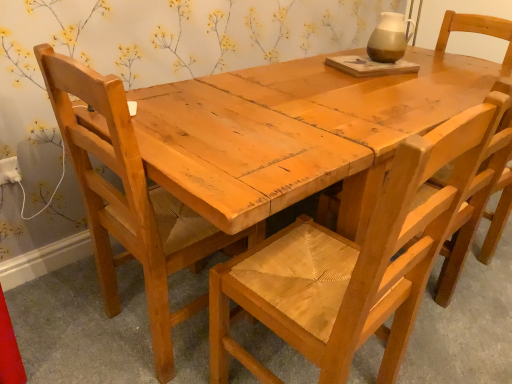
What is the approximate height of natural wood chair at left, marked as the 1th chair in a left-to-right arrangement?

37.28 inches.

Find the location of a particular element. This screenshot has width=512, height=384. wooden woven seat at center, which is counted as the 3th chair, starting from the left is located at coordinates (476, 198).

Find the location of `natural wood chair at center, which is counted as the 2th chair, starting from the left`. natural wood chair at center, which is counted as the 2th chair, starting from the left is located at coordinates (355, 261).

Who is shorter, wooden woven seat at center, which is counted as the 3th chair, starting from the left, or white plastic electric outlet at lower left?

Standing shorter between the two is white plastic electric outlet at lower left.

Can you tell me how much wooden woven seat at center, which is counted as the 3th chair, starting from the left, and white plastic electric outlet at lower left differ in facing direction?

They differ by 179 degrees in their facing directions.

Considering the relative sizes of wooden woven seat at center, which is counted as the 3th chair, starting from the left, and white plastic electric outlet at lower left in the image provided, is wooden woven seat at center, which is counted as the 3th chair, starting from the left, thinner than white plastic electric outlet at lower left?

No.

Which object is more forward, wooden woven seat at center, marked as the 1th chair in a right-to-left arrangement, or white plastic electric outlet at lower left?

wooden woven seat at center, marked as the 1th chair in a right-to-left arrangement, is more forward.

Could you tell me if natural wood chair at center, placed as the second chair when sorted from right to left, is facing wooden woven seat at center, marked as the 1th chair in a right-to-left arrangement?

No.

Is natural wood chair at center, placed as the second chair when sorted from right to left, not close to wooden woven seat at center, which is counted as the 3th chair, starting from the left?

Actually, natural wood chair at center, placed as the second chair when sorted from right to left, and wooden woven seat at center, which is counted as the 3th chair, starting from the left, are a little close together.

From the image's perspective, which object appears higher, natural wood chair at center, which is counted as the 2th chair, starting from the left, or wooden woven seat at center, marked as the 1th chair in a right-to-left arrangement?

wooden woven seat at center, marked as the 1th chair in a right-to-left arrangement.

Is natural wood chair at center, which is counted as the 2th chair, starting from the left, to the left of wooden woven seat at center, marked as the 1th chair in a right-to-left arrangement, from the viewer's perspective?

Indeed, natural wood chair at center, which is counted as the 2th chair, starting from the left, is positioned on the left side of wooden woven seat at center, marked as the 1th chair in a right-to-left arrangement.

Considering the sizes of natural wood chair at center, which is counted as the 2th chair, starting from the left, and natural wood chair at left, marked as the third chair in a right-to-left arrangement, in the image, is natural wood chair at center, which is counted as the 2th chair, starting from the left, wider or thinner than natural wood chair at left, marked as the third chair in a right-to-left arrangement,?

natural wood chair at center, which is counted as the 2th chair, starting from the left, is thinner than natural wood chair at left, marked as the third chair in a right-to-left arrangement.

From the image's perspective, between natural wood chair at center, which is counted as the 2th chair, starting from the left, and natural wood chair at left, marked as the 1th chair in a left-to-right arrangement, which one is located above?

natural wood chair at left, marked as the 1th chair in a left-to-right arrangement.

Is natural wood chair at center, which is counted as the 2th chair, starting from the left, not within natural wood chair at left, marked as the third chair in a right-to-left arrangement?

Yes.

In terms of size, does natural wood chair at center, placed as the second chair when sorted from right to left, appear bigger or smaller than natural wood chair at left, marked as the 1th chair in a left-to-right arrangement?

Clearly, natural wood chair at center, placed as the second chair when sorted from right to left, is smaller in size than natural wood chair at left, marked as the 1th chair in a left-to-right arrangement.

From the picture: Can you tell me how much white plastic electric outlet at lower left and wooden woven seat at center, which is counted as the 3th chair, starting from the left, differ in facing direction?

The facing directions of white plastic electric outlet at lower left and wooden woven seat at center, which is counted as the 3th chair, starting from the left, are 179 degrees apart.

Considering the relative sizes of white plastic electric outlet at lower left and wooden woven seat at center, marked as the 1th chair in a right-to-left arrangement, in the image provided, is white plastic electric outlet at lower left wider than wooden woven seat at center, marked as the 1th chair in a right-to-left arrangement,?

Incorrect, the width of white plastic electric outlet at lower left does not surpass that of wooden woven seat at center, marked as the 1th chair in a right-to-left arrangement.

Does white plastic electric outlet at lower left come in front of wooden woven seat at center, marked as the 1th chair in a right-to-left arrangement?

No, white plastic electric outlet at lower left is behind wooden woven seat at center, marked as the 1th chair in a right-to-left arrangement.

Is white plastic electric outlet at lower left beside wooden woven seat at center, marked as the 1th chair in a right-to-left arrangement?

No, white plastic electric outlet at lower left is not touching wooden woven seat at center, marked as the 1th chair in a right-to-left arrangement.

Between point (485, 161) and point (116, 82), which one is positioned behind?

Positioned behind is point (485, 161).

Is natural wood chair at left, marked as the 1th chair in a left-to-right arrangement, a part of wooden woven seat at center, marked as the 1th chair in a right-to-left arrangement?

No, wooden woven seat at center, marked as the 1th chair in a right-to-left arrangement, does not contain natural wood chair at left, marked as the 1th chair in a left-to-right arrangement.

Between wooden woven seat at center, which is counted as the 3th chair, starting from the left, and natural wood chair at left, marked as the 1th chair in a left-to-right arrangement, which one has larger size?

With larger size is natural wood chair at left, marked as the 1th chair in a left-to-right arrangement.

Is wooden woven seat at center, which is counted as the 3th chair, starting from the left, positioned with its back to natural wood chair at left, marked as the 1th chair in a left-to-right arrangement?

That's not correct — wooden woven seat at center, which is counted as the 3th chair, starting from the left, is not looking away from natural wood chair at left, marked as the 1th chair in a left-to-right arrangement.

Is natural wood chair at left, marked as the 1th chair in a left-to-right arrangement, facing towards wooden woven seat at center, which is counted as the 3th chair, starting from the left?

No, natural wood chair at left, marked as the 1th chair in a left-to-right arrangement, is not turned towards wooden woven seat at center, which is counted as the 3th chair, starting from the left.

Where is `chair lying behind the natural wood chair at left, marked as the 1th chair in a left-to-right arrangement`? chair lying behind the natural wood chair at left, marked as the 1th chair in a left-to-right arrangement is located at coordinates (476, 198).

From a real-world perspective, is natural wood chair at left, marked as the third chair in a right-to-left arrangement, beneath wooden woven seat at center, which is counted as the 3th chair, starting from the left?

Actually, natural wood chair at left, marked as the third chair in a right-to-left arrangement, is physically above wooden woven seat at center, which is counted as the 3th chair, starting from the left, in the real world.

How much distance is there between natural wood chair at left, marked as the 1th chair in a left-to-right arrangement, and wooden woven seat at center, marked as the 1th chair in a right-to-left arrangement?

natural wood chair at left, marked as the 1th chair in a left-to-right arrangement, and wooden woven seat at center, marked as the 1th chair in a right-to-left arrangement, are 32.09 inches apart.

In the scene shown: Is wooden woven seat at center, which is counted as the 3th chair, starting from the left, not near natural wood chair at center, placed as the second chair when sorted from right to left?

They are positioned close to each other.

Is point (426, 195) farther from viewer compared to point (430, 261)?

That is True.

From the picture: From the image's perspective, is wooden woven seat at center, marked as the 1th chair in a right-to-left arrangement, over natural wood chair at center, placed as the second chair when sorted from right to left?

Correct, wooden woven seat at center, marked as the 1th chair in a right-to-left arrangement, appears higher than natural wood chair at center, placed as the second chair when sorted from right to left, in the image.

Which chair is the 1st one when counting from the front of the white plastic electric outlet at lower left? Please provide its 2D coordinates.

[(476, 198)]

Find the location of a particular element. The image size is (512, 384). the 2nd chair above the natural wood chair at center, placed as the second chair when sorted from right to left (from the image's perspective) is located at coordinates (476, 198).

In the scene shown: Estimate the real-world distances between objects in this image. Which object is closer to wooden woven seat at center, which is counted as the 3th chair, starting from the left, natural wood chair at left, marked as the 1th chair in a left-to-right arrangement, or natural wood chair at center, placed as the second chair when sorted from right to left?

natural wood chair at center, placed as the second chair when sorted from right to left, is closer to wooden woven seat at center, which is counted as the 3th chair, starting from the left.

When comparing their distances from white plastic electric outlet at lower left, does wooden woven seat at center, marked as the 1th chair in a right-to-left arrangement, or natural wood chair at center, placed as the second chair when sorted from right to left, seem further?

wooden woven seat at center, marked as the 1th chair in a right-to-left arrangement, is further to white plastic electric outlet at lower left.

Consider the image. Which object lies further to the anchor point white plastic electric outlet at lower left, natural wood chair at center, placed as the second chair when sorted from right to left, or wooden woven seat at center, which is counted as the 3th chair, starting from the left?

wooden woven seat at center, which is counted as the 3th chair, starting from the left.

In the scene shown: Looking at the image, which one is located further to natural wood chair at center, which is counted as the 2th chair, starting from the left, white plastic electric outlet at lower left or wooden woven seat at center, marked as the 1th chair in a right-to-left arrangement?

white plastic electric outlet at lower left is positioned further to the anchor natural wood chair at center, which is counted as the 2th chair, starting from the left.

Looking at the image, which one is located closer to natural wood chair at left, marked as the third chair in a right-to-left arrangement, wooden woven seat at center, which is counted as the 3th chair, starting from the left, or white plastic electric outlet at lower left?

Based on the image, white plastic electric outlet at lower left appears to be nearer to natural wood chair at left, marked as the third chair in a right-to-left arrangement.

When comparing their distances from white plastic electric outlet at lower left, does natural wood chair at left, marked as the 1th chair in a left-to-right arrangement, or wooden woven seat at center, which is counted as the 3th chair, starting from the left, seem further?

Among the two, wooden woven seat at center, which is counted as the 3th chair, starting from the left, is located further to white plastic electric outlet at lower left.

From the image, which object appears to be nearer to wooden woven seat at center, marked as the 1th chair in a right-to-left arrangement, natural wood chair at left, marked as the 1th chair in a left-to-right arrangement, or white plastic electric outlet at lower left?

natural wood chair at left, marked as the 1th chair in a left-to-right arrangement.

Considering their positions, is wooden woven seat at center, which is counted as the 3th chair, starting from the left, positioned closer to natural wood chair at center, which is counted as the 2th chair, starting from the left, than white plastic electric outlet at lower left?

wooden woven seat at center, which is counted as the 3th chair, starting from the left, is positioned closer to the anchor natural wood chair at center, which is counted as the 2th chair, starting from the left.

This screenshot has height=384, width=512. Identify the location of chair between natural wood chair at left, marked as the third chair in a right-to-left arrangement, and wooden woven seat at center, which is counted as the 3th chair, starting from the left, from left to right. (x=355, y=261).

In order to click on chair between white plastic electric outlet at lower left and natural wood chair at center, which is counted as the 2th chair, starting from the left, in the horizontal direction in this screenshot , I will do `click(130, 200)`.